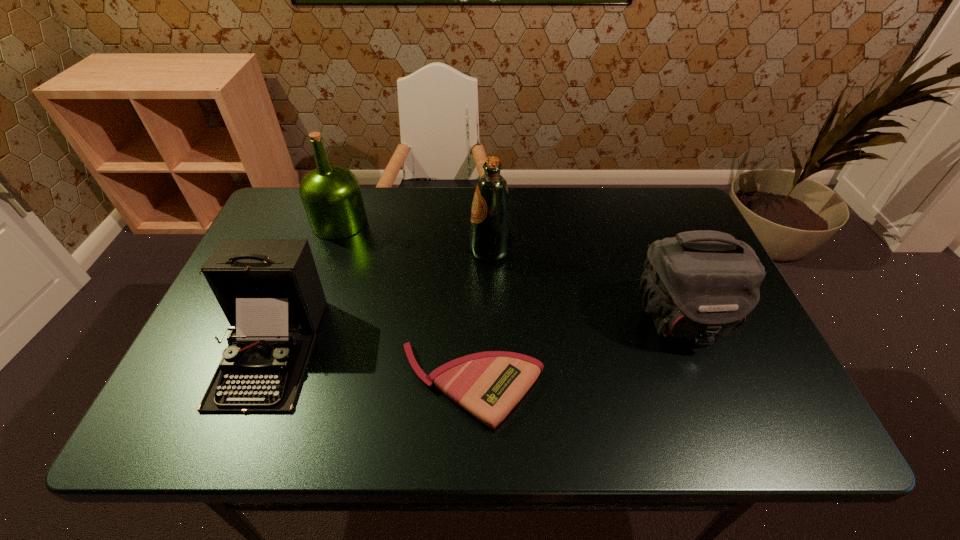
At what (x,y) coordinates should I click in order to perform the action: click on free spot between the shoulder bag and the left olive oil. Please return your answer as a coordinate pair (x, y). This screenshot has height=540, width=960. Looking at the image, I should click on (510, 271).

Image resolution: width=960 pixels, height=540 pixels. In order to click on the closest object to the typewriter in this screenshot , I will do `click(488, 385)`.

Identify which object is the nearest to the wristlet. Please provide its 2D coordinates. Your answer should be formatted as a tuple, i.e. [(x, y)], where the tuple contains the x and y coordinates of a point satisfying the conditions above.

[(269, 289)]

This screenshot has height=540, width=960. Find the location of `free location that satisfies the following two spatial constraints: 1. on the front-facing side of the right olive oil; 2. inside the open case of the typewriter`. free location that satisfies the following two spatial constraints: 1. on the front-facing side of the right olive oil; 2. inside the open case of the typewriter is located at coordinates (493, 349).

Image resolution: width=960 pixels, height=540 pixels. What are the coordinates of `vacant space that satisfies the following two spatial constraints: 1. inside the open case of the shortest object; 2. on the right side of the typewriter` in the screenshot? It's located at (256, 385).

Find the location of `free spot that satisfies the following two spatial constraints: 1. inside the open case of the typewriter; 2. on the left side of the shortest object`. free spot that satisfies the following two spatial constraints: 1. inside the open case of the typewriter; 2. on the left side of the shortest object is located at coordinates (256, 385).

Identify the location of free space in the image that satisfies the following two spatial constraints: 1. on the front-facing side of the right olive oil; 2. inside the open case of the typewriter. The height and width of the screenshot is (540, 960). (493, 349).

Locate an element on the screen. This screenshot has height=540, width=960. vacant space that satisfies the following two spatial constraints: 1. inside the open case of the wristlet; 2. on the left side of the typewriter is located at coordinates (256, 385).